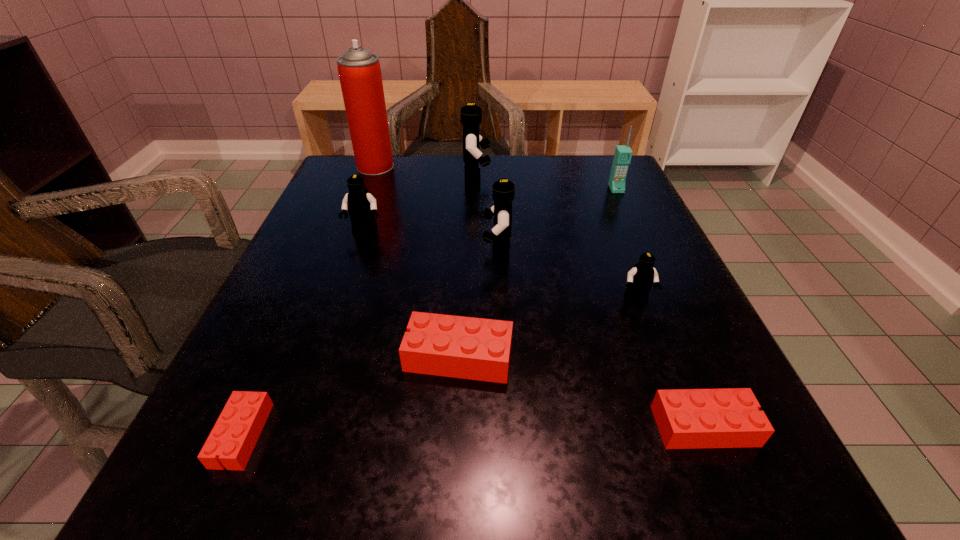
Where is `empty space between the rightmost red Lego and the smallest red Lego`? The height and width of the screenshot is (540, 960). empty space between the rightmost red Lego and the smallest red Lego is located at coordinates (473, 430).

At what (x,y) coordinates should I click in order to perform the action: click on free spot between the biggest red Lego and the second biggest red Lego. Please return your answer as a coordinate pair (x, y). Looking at the image, I should click on (582, 392).

Where is `object that is the eighth closest to the second smallest black Lego`? This screenshot has width=960, height=540. object that is the eighth closest to the second smallest black Lego is located at coordinates (686, 418).

Find the location of a particular element. the closest object to the aerosol can is located at coordinates (471, 115).

Choose which Lego is the nearest neighbor to the cellular telephone. Please provide its 2D coordinates. Your answer should be formatted as a tuple, i.e. [(x, y)], where the tuple contains the x and y coordinates of a point satisfying the conditions above.

[(471, 115)]

You are a GUI agent. You are given a task and a screenshot of the screen. Output one action in this format:
    pyautogui.click(x=<x>, y=<y>)
    Task: Click on the Lego that stands as the seventh closest to the cellular telephone
    The width and height of the screenshot is (960, 540).
    Given the screenshot: What is the action you would take?
    pyautogui.click(x=234, y=436)

The width and height of the screenshot is (960, 540). I want to click on black Lego that is the third nearest to the eighth shortest object, so click(x=640, y=278).

Locate which black Lego ranks in proximity to the tallest Lego. Please provide its 2D coordinates. Your answer should be formatted as a tuple, i.e. [(x, y)], where the tuple contains the x and y coordinates of a point satisfying the conditions above.

[(503, 191)]

This screenshot has width=960, height=540. What are the coordinates of `red Lego that can be found as the closest to the farthest black Lego` in the screenshot? It's located at (462, 347).

Locate which red Lego ranks second in proximity to the tallest object. Please provide its 2D coordinates. Your answer should be formatted as a tuple, i.e. [(x, y)], where the tuple contains the x and y coordinates of a point satisfying the conditions above.

[(234, 436)]